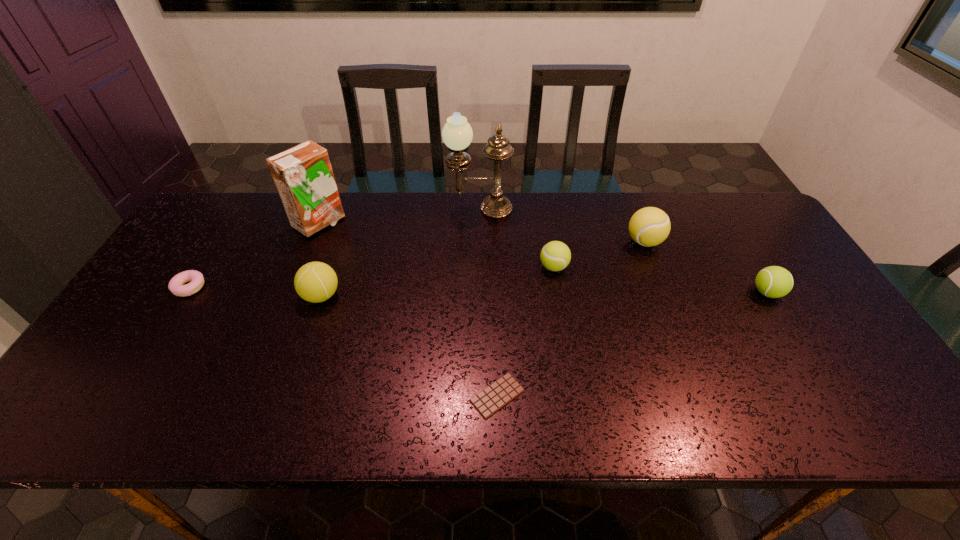
The width and height of the screenshot is (960, 540). Identify the location of vacant space at the far right corner. (747, 193).

Locate an element on the screen. The height and width of the screenshot is (540, 960). free space between the leftmost object and the third tennis ball from right to left is located at coordinates (372, 278).

This screenshot has height=540, width=960. What are the coordinates of `vacant space that's between the third nearest tennis ball and the nearest object` in the screenshot? It's located at (525, 332).

Image resolution: width=960 pixels, height=540 pixels. Find the location of `blank region between the shortest object and the farthest tennis ball`. blank region between the shortest object and the farthest tennis ball is located at coordinates (571, 319).

This screenshot has width=960, height=540. Identify the location of free space between the farthest tennis ball and the doughnut. (417, 265).

The image size is (960, 540). What are the coordinates of `free spot between the third nearest tennis ball and the carton` in the screenshot? It's located at (436, 245).

Where is `free space between the rightmost tennis ball and the nearest object`? The image size is (960, 540). free space between the rightmost tennis ball and the nearest object is located at coordinates pyautogui.click(x=632, y=345).

The width and height of the screenshot is (960, 540). What are the coordinates of `free spot between the nearest object and the seventh shortest object` in the screenshot? It's located at (408, 309).

Where is `free spot between the candy bar and the tallest object`? This screenshot has width=960, height=540. free spot between the candy bar and the tallest object is located at coordinates (489, 302).

Identify the location of free spot between the candy bar and the leftmost object. (344, 342).